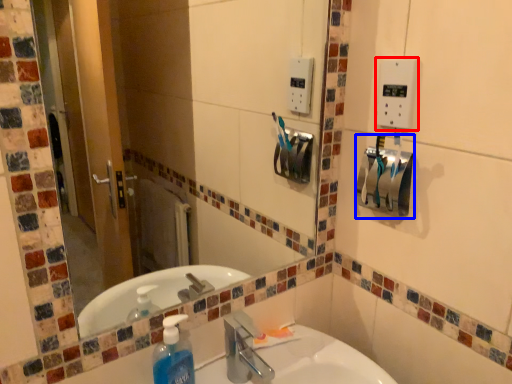
Question: Which object is closer to the camera taking this photo, light switch (highlighted by a red box) or hand dryer (highlighted by a blue box)?

Choices:
 (A) light switch
 (B) hand dryer

Answer: (A)